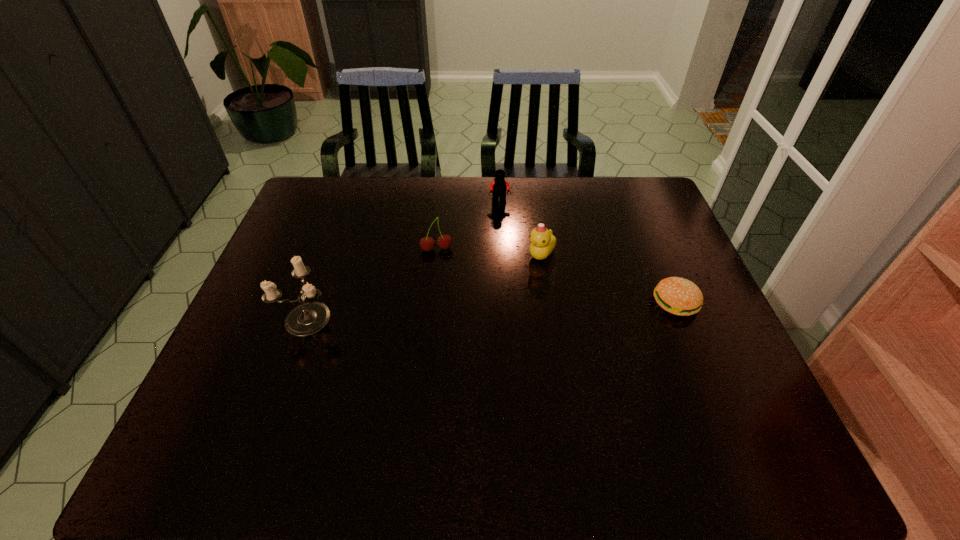
This screenshot has height=540, width=960. Find the location of `vacant area situated on the front-facing side of the Lego`. vacant area situated on the front-facing side of the Lego is located at coordinates [500, 242].

Image resolution: width=960 pixels, height=540 pixels. I want to click on vacant region located on the front-facing side of the Lego, so click(500, 245).

Find the location of a particular element. This screenshot has width=960, height=540. blank space located 0.370m on the front-facing side of the Lego is located at coordinates (502, 288).

The height and width of the screenshot is (540, 960). Identify the location of vacant space situated on the surface of the second object from left to right. (440, 272).

Locate an element on the screen. vacant area situated on the surface of the second object from left to right is located at coordinates (443, 309).

At what (x,y) coordinates should I click in order to perform the action: click on free region located 0.250m on the surface of the second object from left to right. Please return your answer as a coordinate pair (x, y). This screenshot has width=960, height=540. Looking at the image, I should click on (444, 321).

The height and width of the screenshot is (540, 960). I want to click on blank space located on the front-facing side of the second object from right to left, so click(x=508, y=376).

At what (x,y) coordinates should I click in order to perform the action: click on vacant space situated 0.290m on the front-facing side of the second object from right to left. Please return your answer as a coordinate pair (x, y). This screenshot has width=960, height=540. Looking at the image, I should click on (516, 346).

Find the location of a particular element. Image resolution: width=960 pixels, height=540 pixels. vacant space positioned on the front-facing side of the second object from right to left is located at coordinates point(516,349).

At what (x,y) coordinates should I click in order to perform the action: click on object that is at the far edge. Please return your answer as a coordinate pair (x, y). Looking at the image, I should click on (499, 186).